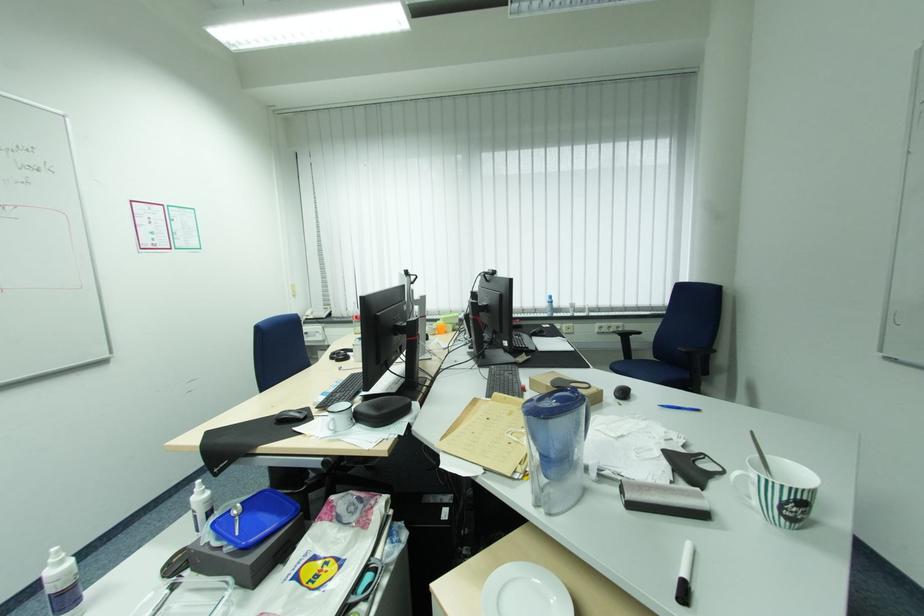
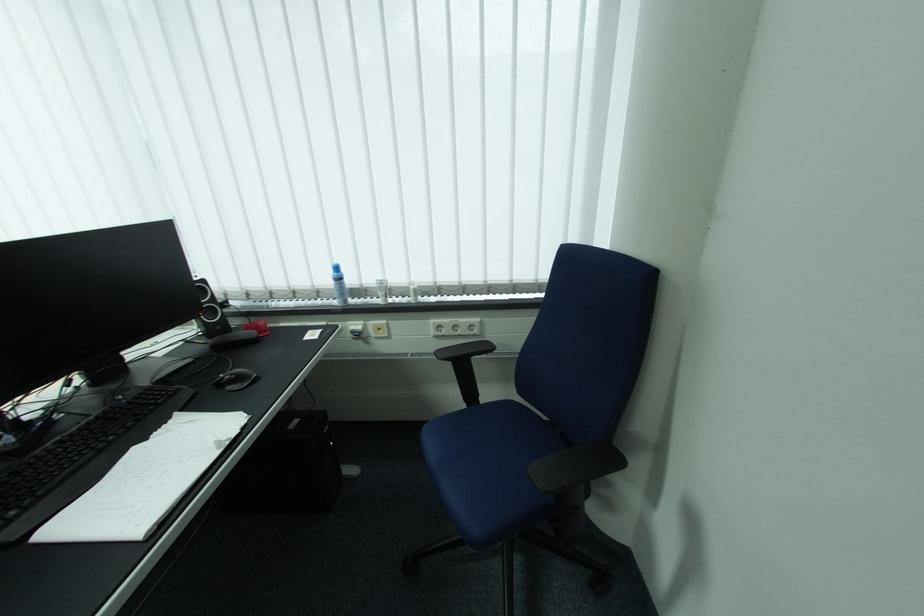
Find the pixel in the second image that matches the point at 552,314 in the first image.

(342, 302)